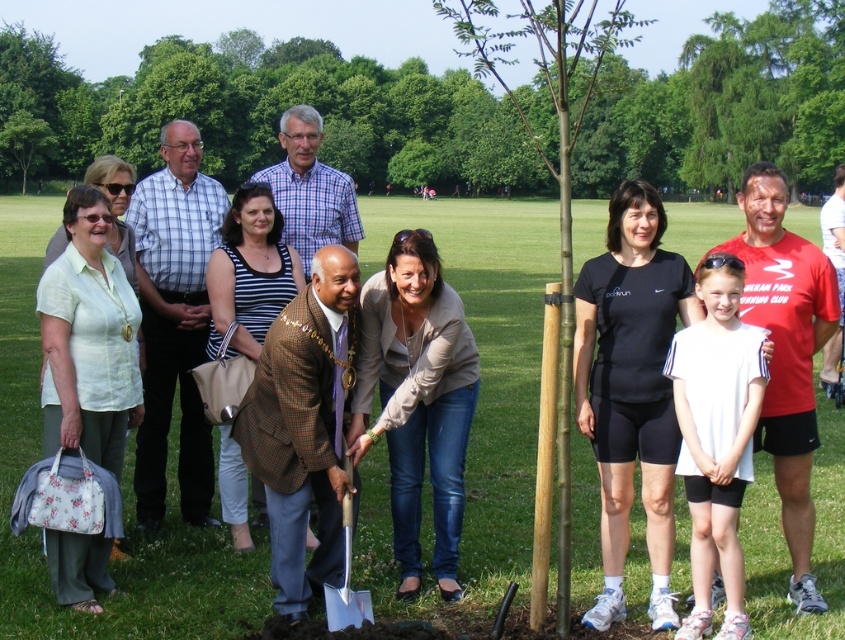
You are organizing a tree planting event and need to ensure the green bamboo at center can be properly planted using the silver metallic shovel at center. Based on their sizes, will the shovel be sufficient to dig a hole for the bamboo?

The green bamboo at center has a larger size compared to the silver metallic shovel at center. This means the shovel may not be large enough to efficiently dig a hole of appropriate size for the bamboo, so a larger shovel or alternative tool might be needed.

Based on the scene description, which object is taller between the green smooth bark tree at center and the beige textured blazer at center?

The green smooth bark tree at center is taller than the beige textured blazer at center according to the description.